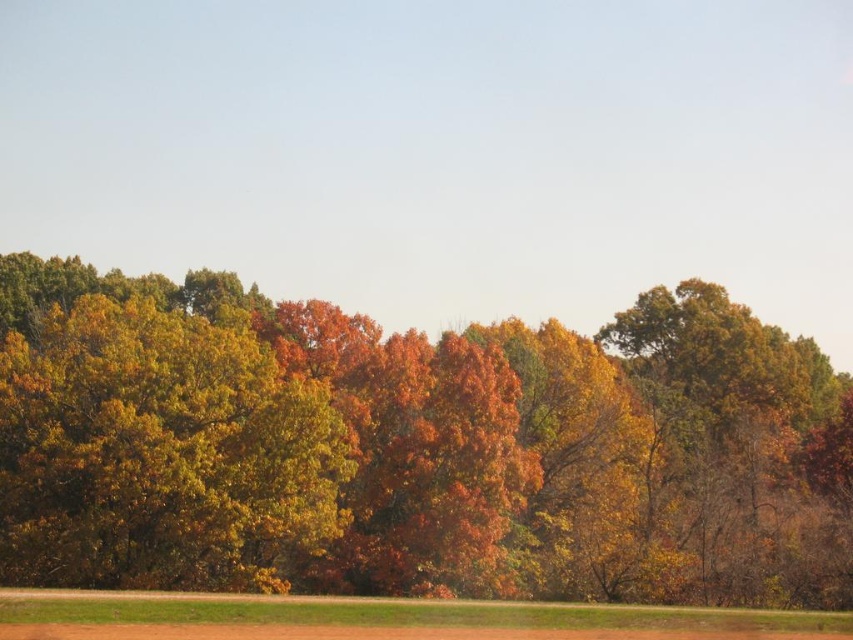
Is autumn foliage at center taller than golden textured leaves at left?

Yes.

Does autumn foliage at center lie behind golden textured leaves at left?

That is True.

Does point (467, 579) come farther from viewer compared to point (22, 444)?

Yes, it is behind point (22, 444).

Image resolution: width=853 pixels, height=640 pixels. Find the location of `autumn foliage at center`. autumn foliage at center is located at coordinates (412, 449).